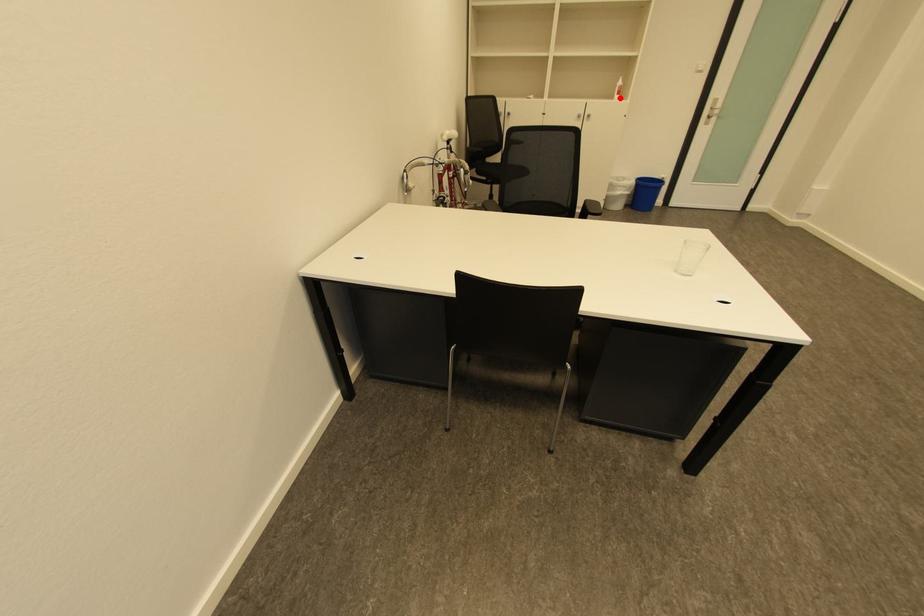
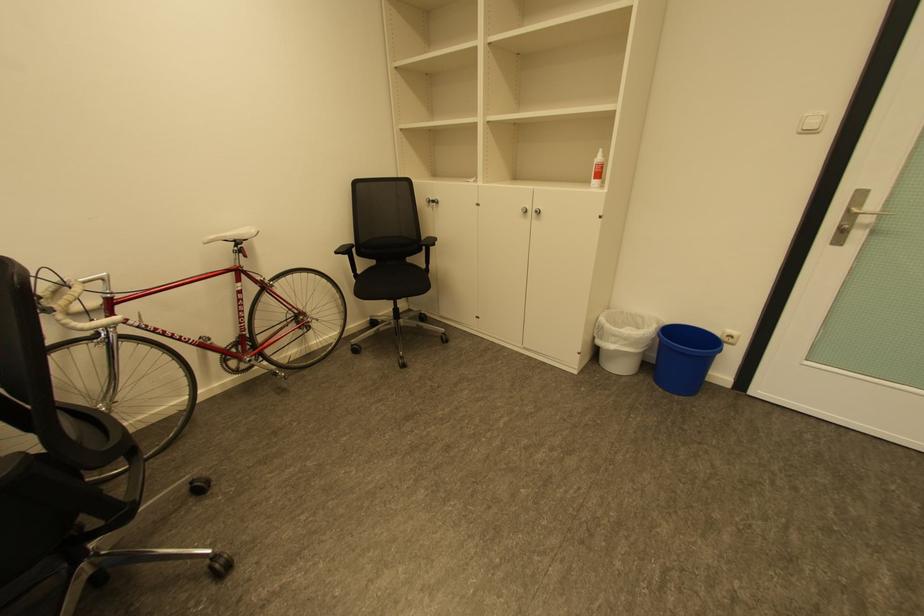
In the second image, find the point that corresponds to the highlighted location in the first image.

(597, 184)